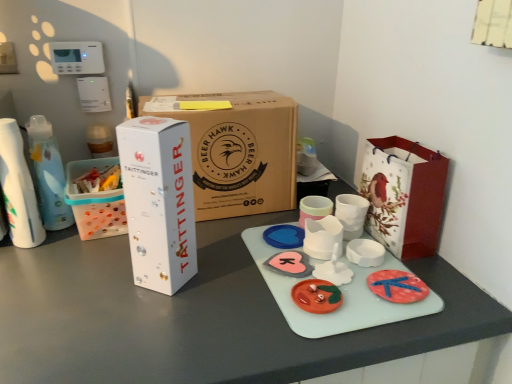
What are the coordinates of `vacant space in front of white glossy cup at center, which is counted as the 3th toy, starting from the back` in the screenshot? It's located at (337, 323).